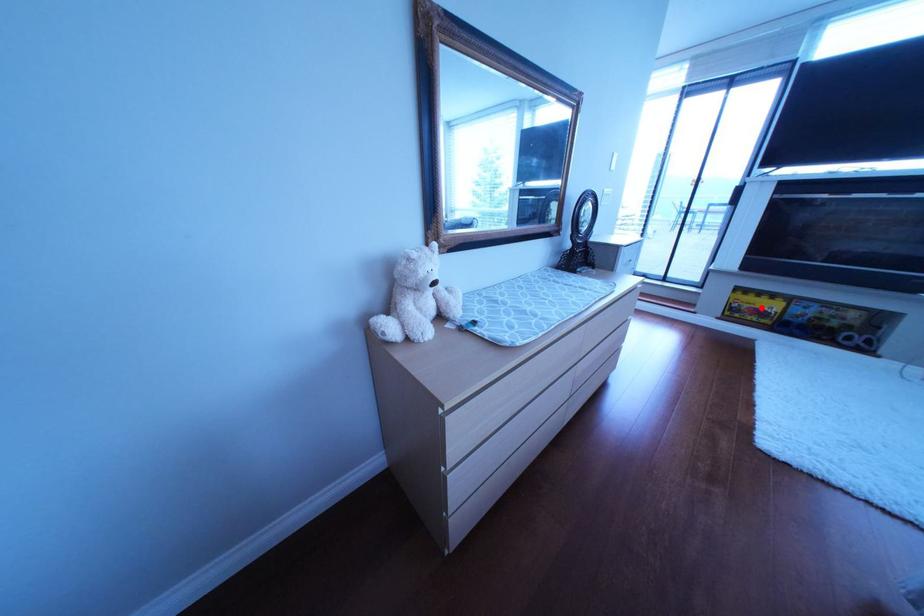
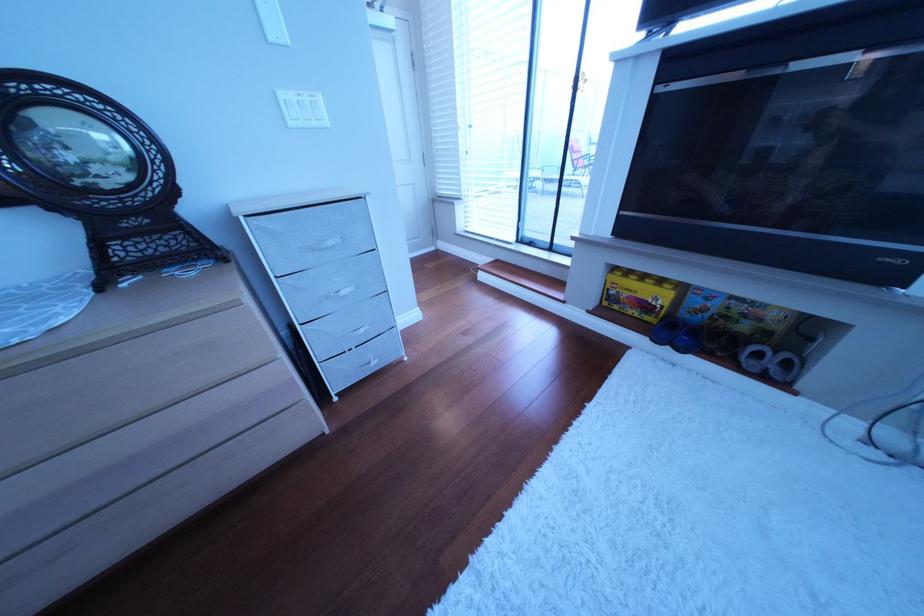
Question: I am providing you with two images of the same scene from different viewpoints. Given a red point in image1, look at the same physical point in image2. Is it:

Choices:
 (A) Closer to the viewpoint
 (B) Farther from the viewpoint

Answer: (A)